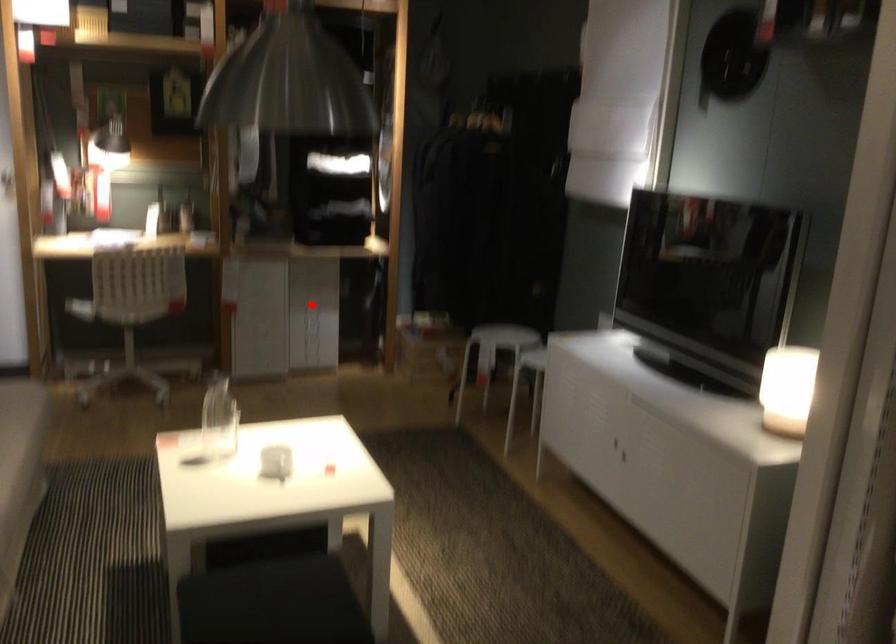
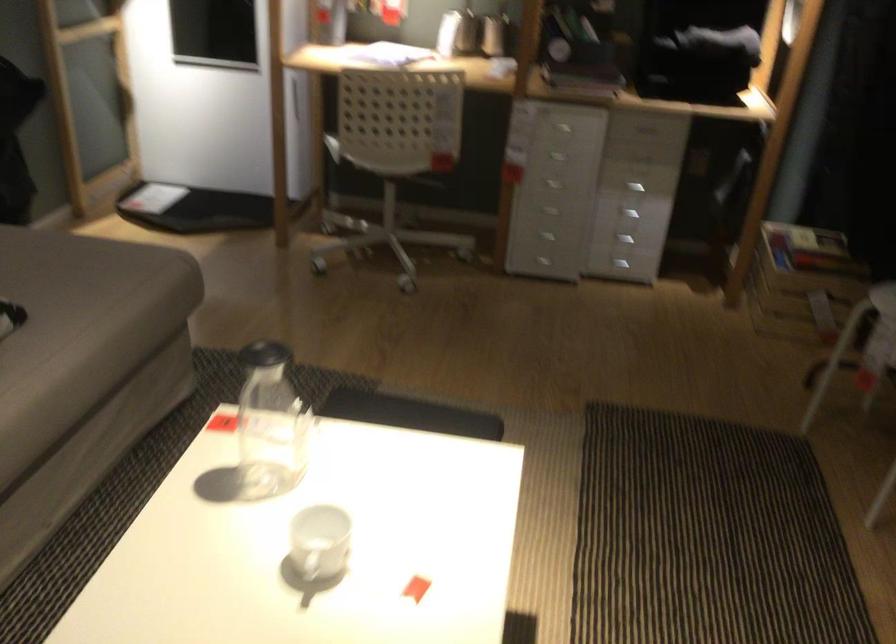
Where in the second image is the point corresponding to the highlighted location from the first image?

(634, 187)